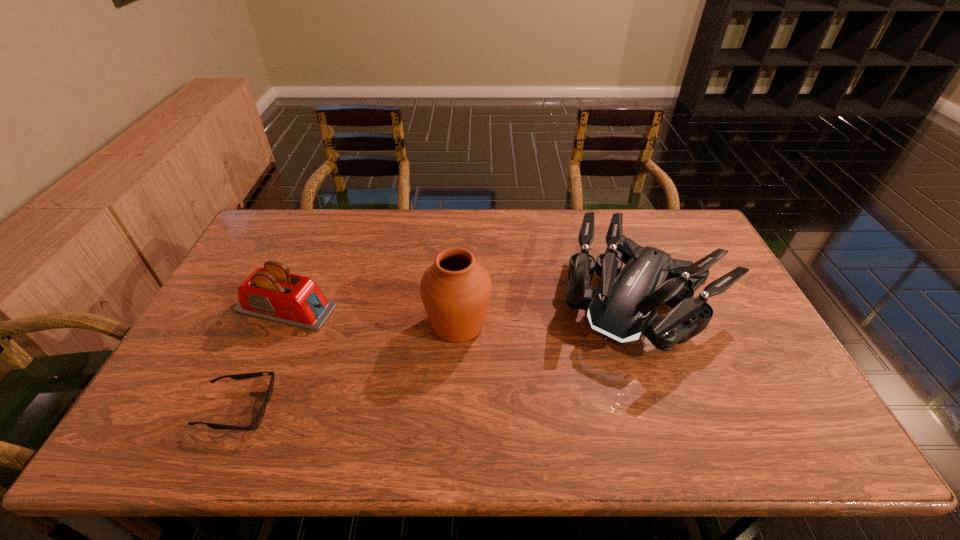
At what (x,y) coordinates should I click in order to perform the action: click on the second object from right to left. Please return your answer as a coordinate pair (x, y). This screenshot has width=960, height=540. Looking at the image, I should click on (456, 290).

This screenshot has height=540, width=960. What are the coordinates of `the tallest object` in the screenshot? It's located at (456, 290).

Where is `drone`? This screenshot has height=540, width=960. drone is located at coordinates [x=625, y=307].

Image resolution: width=960 pixels, height=540 pixels. In order to click on toaster in this screenshot , I will do `click(272, 293)`.

In order to click on the nearest object in this screenshot , I will do `click(257, 420)`.

This screenshot has height=540, width=960. I want to click on sunglasses, so click(257, 420).

Identify the location of blank space located on the left of the third object from left to right. (320, 324).

You are a GUI agent. You are given a task and a screenshot of the screen. Output one action in this format:
    pyautogui.click(x=<x>, y=<y>)
    Task: Click on the vacant space located 0.340m on the left of the rightmost object
    This screenshot has width=960, height=540.
    Given the screenshot: What is the action you would take?
    pyautogui.click(x=446, y=301)

Identify the location of vacant space located 0.100m on the right of the toaster. (370, 308).

Where is `free region located on the front-facing side of the sunglasses`? The height and width of the screenshot is (540, 960). free region located on the front-facing side of the sunglasses is located at coordinates (323, 408).